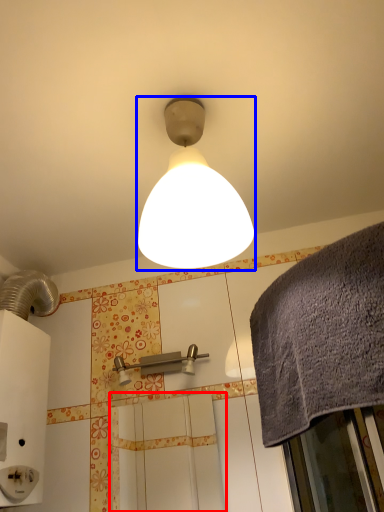
Question: Among these objects, which one is nearest to the camera, screen door (highlighted by a red box) or lamp (highlighted by a blue box)?

Choices:
 (A) screen door
 (B) lamp

Answer: (B)